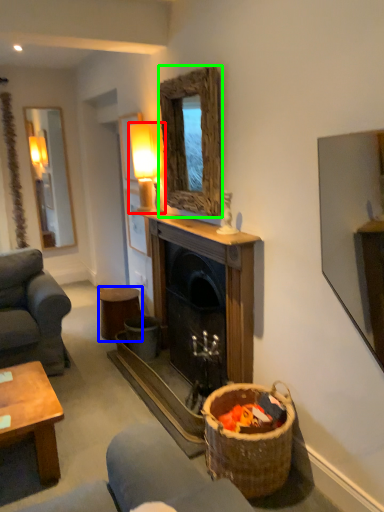
Question: Considering the real-world distances, which object is farthest from lamp (highlighted by a red box)? stool (highlighted by a blue box) or mirror (highlighted by a green box)?

Choices:
 (A) stool
 (B) mirror

Answer: (A)